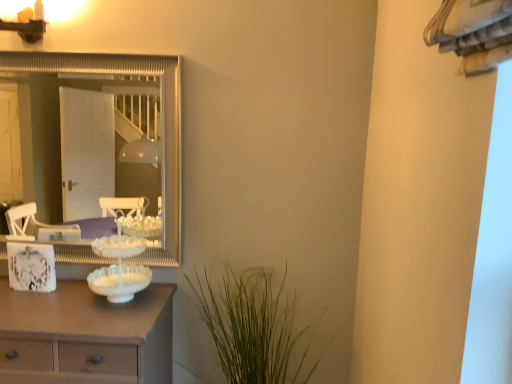
You are a GUI agent. You are given a task and a screenshot of the screen. Output one action in this format:
    pyautogui.click(x=<x>, y=<y>)
    Task: Click on the vacant area situated to the left side of white frosted glass candle holder at center
    
    Given the screenshot: What is the action you would take?
    pyautogui.click(x=54, y=302)